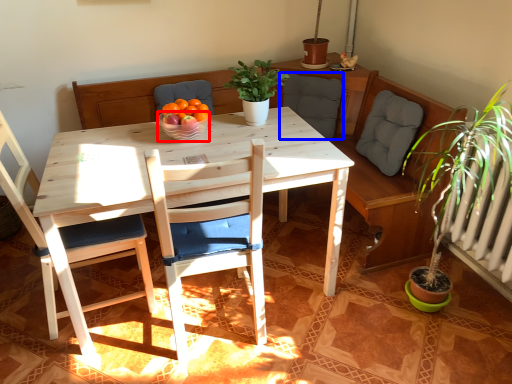
Question: Which of the following is the closest to the observer, glass bowl (highlighted by a red box) or armchair (highlighted by a blue box)?

Choices:
 (A) glass bowl
 (B) armchair

Answer: (A)